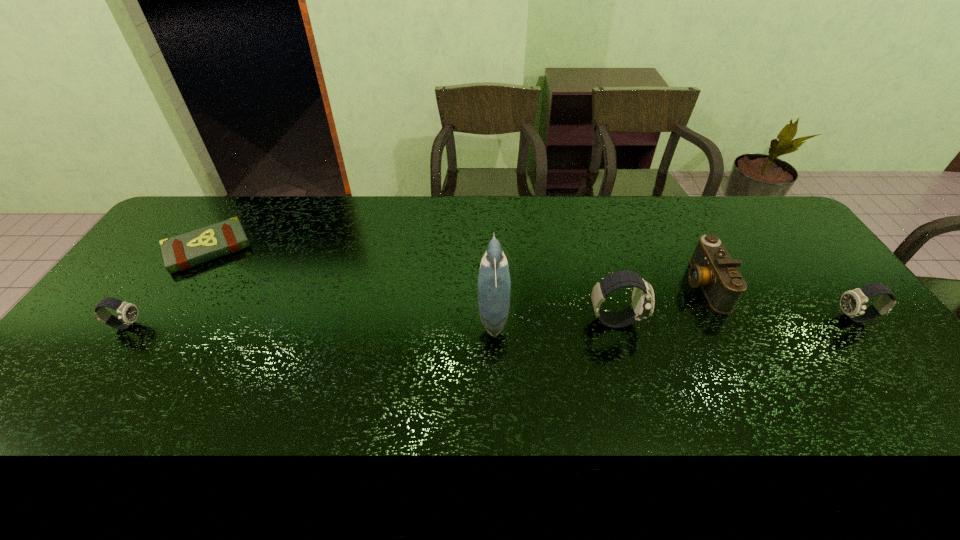
Locate an element on the screen. The width and height of the screenshot is (960, 540). vacant area located at the tip of the bird's beak is located at coordinates (358, 314).

This screenshot has width=960, height=540. I want to click on vacant region located at the tip of the bird's beak, so click(x=443, y=314).

This screenshot has height=540, width=960. Find the location of `object located in the far edge section of the desktop`. object located in the far edge section of the desktop is located at coordinates (181, 252).

The image size is (960, 540). I want to click on watch positioned at the left edge, so click(127, 312).

Identify the location of book present at the left edge. This screenshot has width=960, height=540. (181, 252).

Where is `object that is at the right edge`? The image size is (960, 540). object that is at the right edge is located at coordinates (853, 302).

Locate an element on the screen. This screenshot has height=540, width=960. object at the far left corner is located at coordinates [x=181, y=252].

Locate an element on the screen. Image resolution: width=960 pixels, height=540 pixels. vacant space at the far edge of the desktop is located at coordinates click(x=539, y=237).

Identify the location of vacant space at the near edge. The width and height of the screenshot is (960, 540). (128, 416).

In the image, there is a desktop. What are the coordinates of `vacant space at the left edge` in the screenshot? It's located at (136, 287).